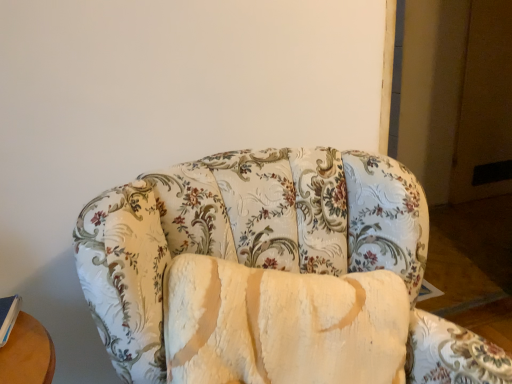
Question: From the image's perspective, is floral fabric couch at center below blue hardcover book at lower left?

Choices:
 (A) no
 (B) yes

Answer: (B)

Question: Is floral fabric couch at center to the right of blue hardcover book at lower left from the viewer's perspective?

Choices:
 (A) no
 (B) yes

Answer: (B)

Question: Could you tell me if floral fabric couch at center is turned towards blue hardcover book at lower left?

Choices:
 (A) yes
 (B) no

Answer: (B)

Question: Considering the relative sizes of floral fabric couch at center and blue hardcover book at lower left in the image provided, is floral fabric couch at center bigger than blue hardcover book at lower left?

Choices:
 (A) yes
 (B) no

Answer: (A)

Question: Is blue hardcover book at lower left completely or partially inside floral fabric couch at center?

Choices:
 (A) no
 (B) yes

Answer: (A)

Question: Are floral fabric couch at center and blue hardcover book at lower left making contact?

Choices:
 (A) no
 (B) yes

Answer: (A)

Question: Does blue hardcover book at lower left lie in front of floral fabric couch at center?

Choices:
 (A) no
 (B) yes

Answer: (A)

Question: Are blue hardcover book at lower left and floral fabric couch at center beside each other?

Choices:
 (A) yes
 (B) no

Answer: (B)

Question: Is blue hardcover book at lower left behind floral fabric couch at center?

Choices:
 (A) no
 (B) yes

Answer: (B)

Question: Is floral fabric couch at center a part of blue hardcover book at lower left?

Choices:
 (A) yes
 (B) no

Answer: (B)

Question: Would you say blue hardcover book at lower left is outside floral fabric couch at center?

Choices:
 (A) yes
 (B) no

Answer: (A)

Question: Is blue hardcover book at lower left aimed at floral fabric couch at center?

Choices:
 (A) no
 (B) yes

Answer: (A)

Question: From their relative heights in the image, would you say blue hardcover book at lower left is taller or shorter than floral fabric couch at center?

Choices:
 (A) short
 (B) tall

Answer: (A)